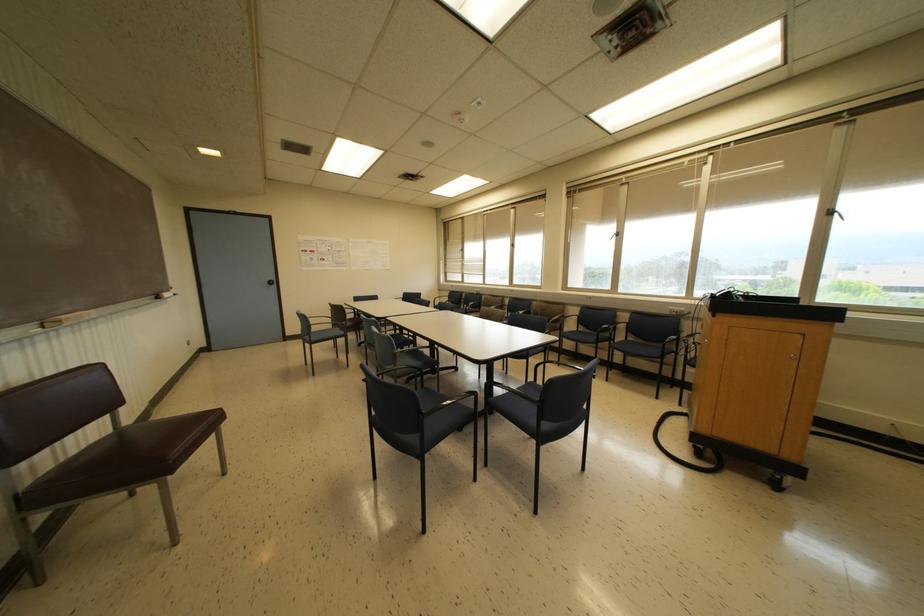
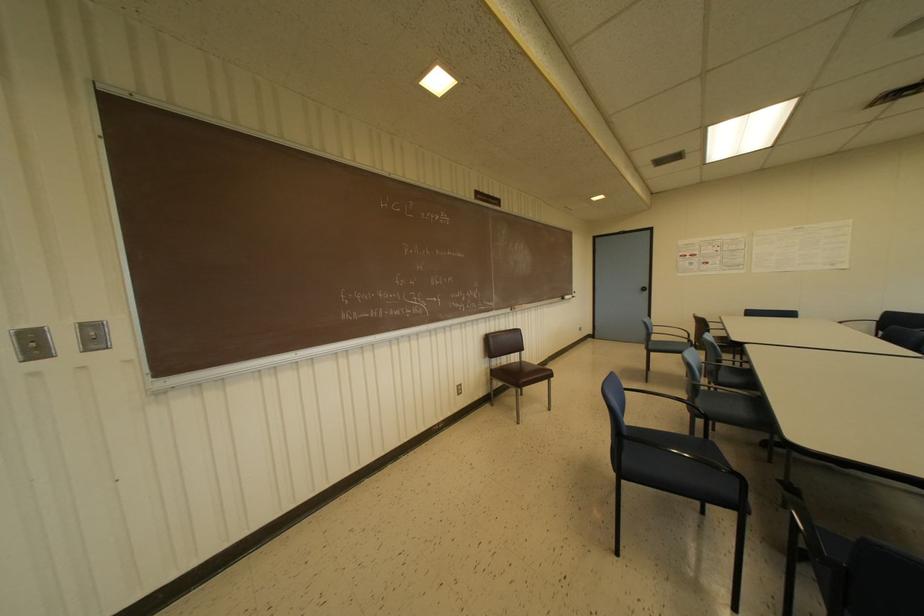
Where in the second image is the point corresponding to (x=118, y=430) from the first image?

(519, 362)